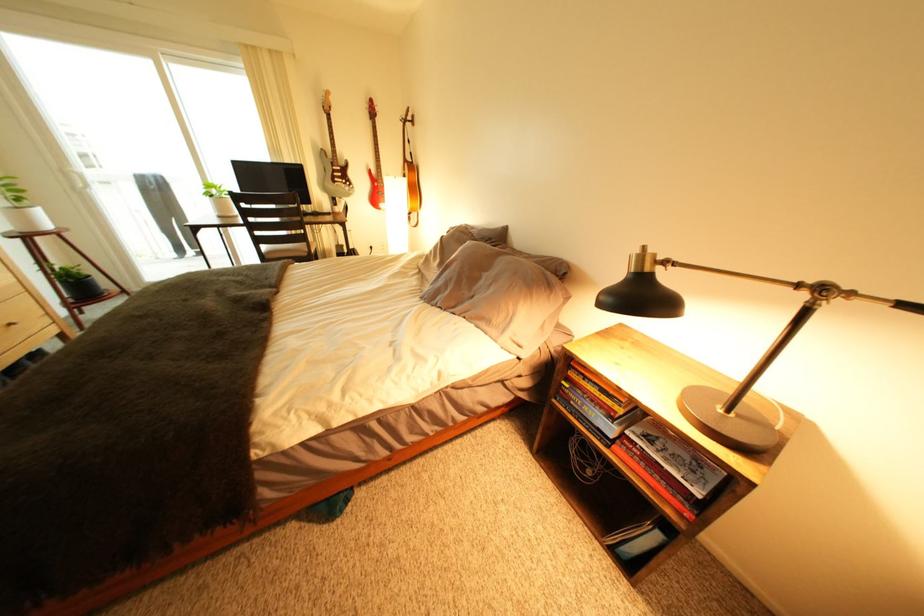
Identify the location of lamp arm joint. (820, 294).